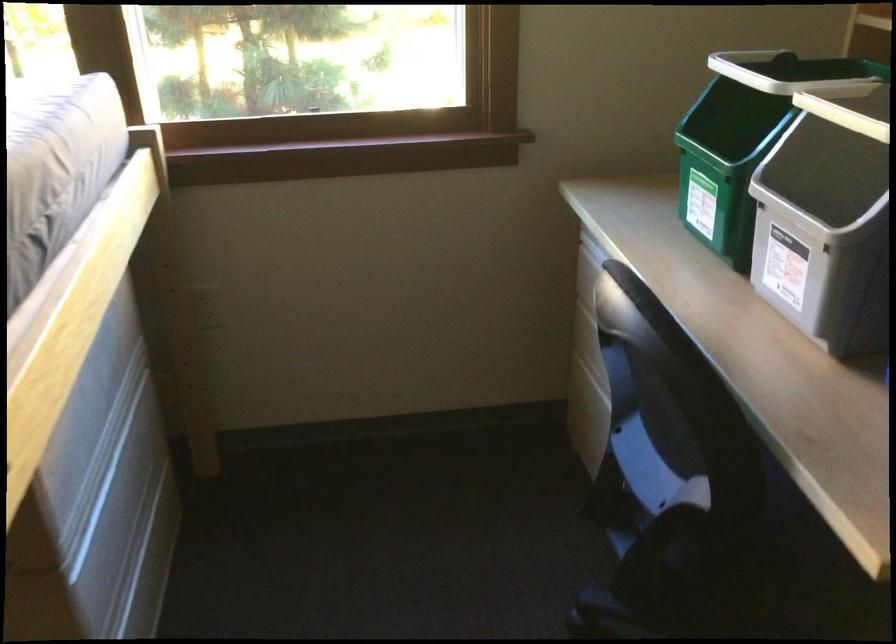
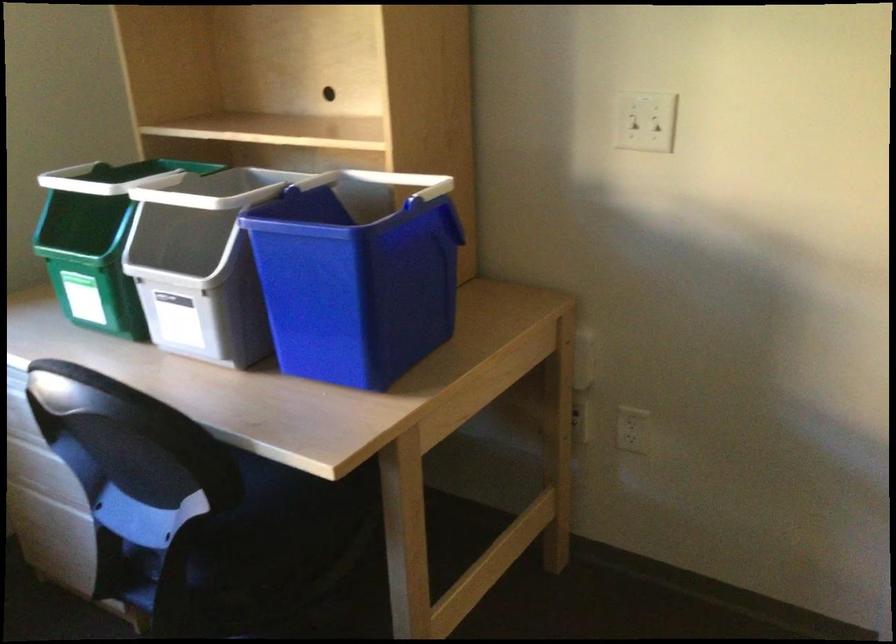
Locate, in the second image, the point that corresponds to [655,462] in the first image.

(151, 518)